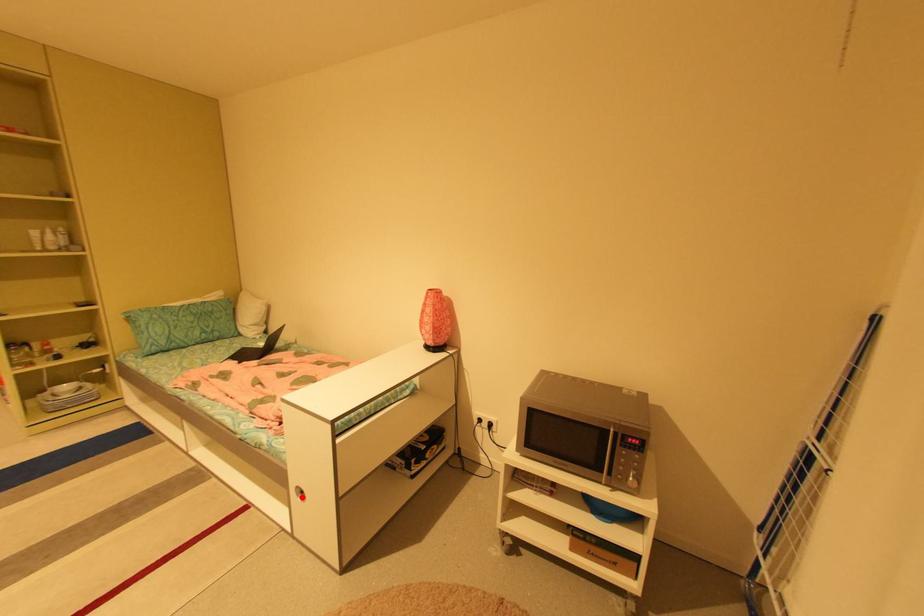
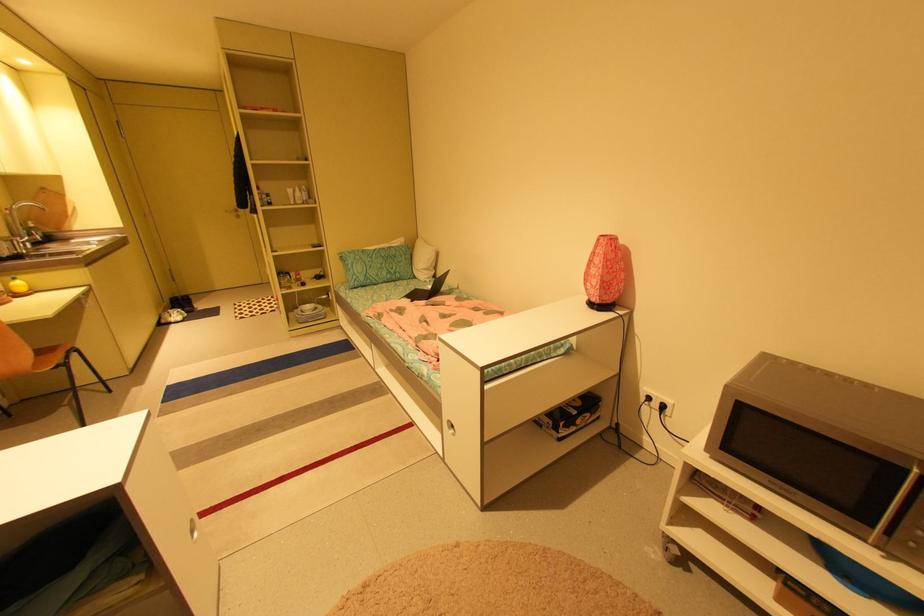
Question: A red point is marked in image1. In image2, is the corresponding 3D point closer to the camera or farther? Reply with the corresponding letter.

Choices:
 (A) The corresponding 3D point is closer.
 (B) The corresponding 3D point is farther.

Answer: (B)